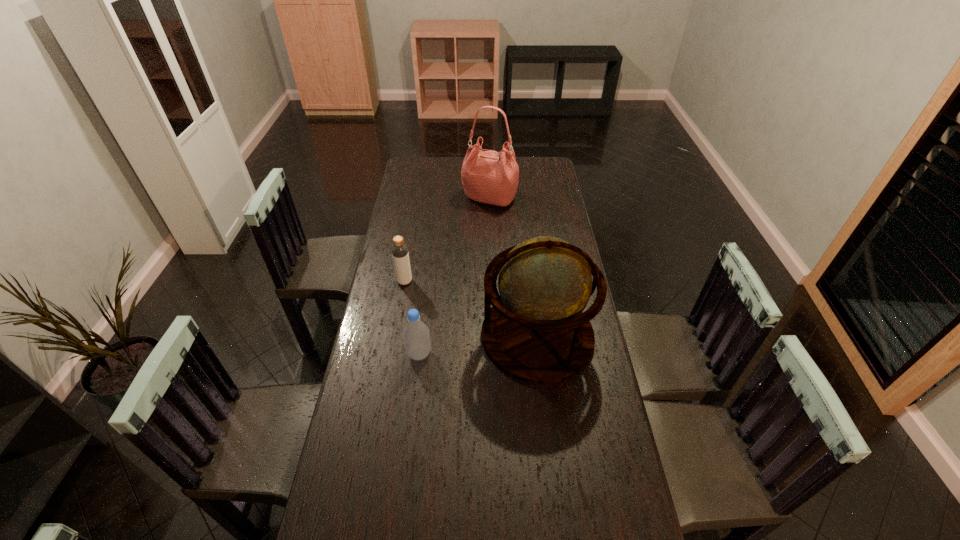
Find the location of a particular element. This screenshot has height=540, width=960. empty location between the right bottle and the globe is located at coordinates (478, 345).

This screenshot has height=540, width=960. What are the coordinates of `unoccupied position between the right bottle and the globe` in the screenshot? It's located at [x=478, y=345].

In order to click on object identified as the closest to the right bottle in this screenshot , I will do coord(536,332).

Where is `object that stands as the closest to the handbag`? The height and width of the screenshot is (540, 960). object that stands as the closest to the handbag is located at coordinates (400, 255).

Point out which bottle is positioned as the second nearest to the farthest object. Please provide its 2D coordinates. Your answer should be formatted as a tuple, i.e. [(x, y)], where the tuple contains the x and y coordinates of a point satisfying the conditions above.

[(416, 336)]

At what (x,y) coordinates should I click in order to perform the action: click on blank area in the image that satisfies the following two spatial constraints: 1. on the front side of the nearer bottle; 2. on the left side of the second farthest object. Please return your answer as a coordinate pair (x, y). The width and height of the screenshot is (960, 540). Looking at the image, I should click on coord(392,354).

This screenshot has height=540, width=960. Find the location of `vacant space that satisfies the following two spatial constraints: 1. on the back side of the handbag; 2. on the right side of the right bottle`. vacant space that satisfies the following two spatial constraints: 1. on the back side of the handbag; 2. on the right side of the right bottle is located at coordinates (438, 198).

In order to click on vacant space that satisfies the following two spatial constraints: 1. on the back side of the leftmost object; 2. on the left side of the handbag in this screenshot , I will do `click(420, 198)`.